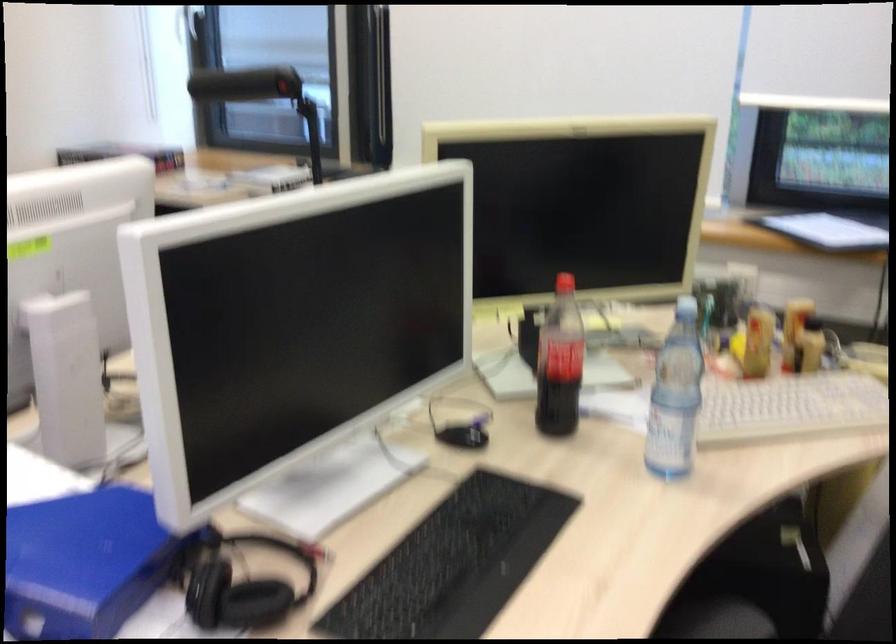
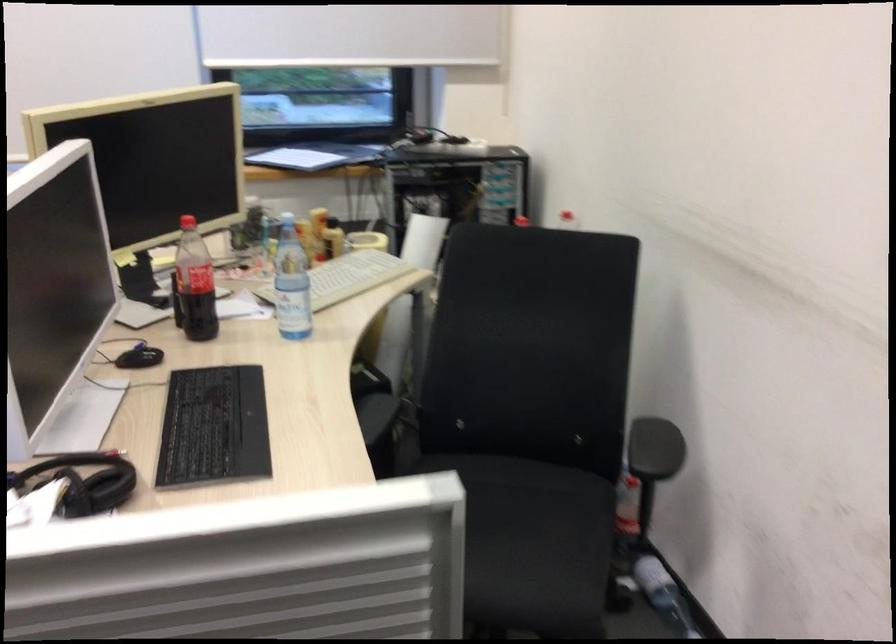
Find the pixel in the second image that matches (467,564) in the first image.

(213, 428)